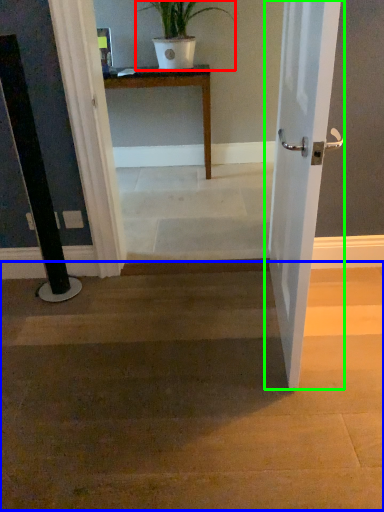
Question: Which object is positioned farthest from houseplant (highlighted by a red box)? Select from stairwell (highlighted by a blue box) and door (highlighted by a green box).

Choices:
 (A) stairwell
 (B) door

Answer: (A)